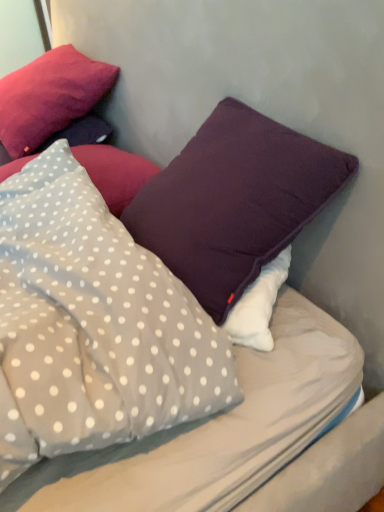
Question: From a real-world perspective, is gray polka dot pillow at center, the fourth pillow when ordered from top to bottom, physically located above or below purple matte pillow at upper right, which appears as the second pillow when ordered from the bottom?

Choices:
 (A) below
 (B) above

Answer: (A)

Question: From the image's perspective, is gray polka dot pillow at center, the fourth pillow when ordered from top to bottom, above or below purple matte pillow at upper right, arranged as the 3th pillow when viewed from the top?

Choices:
 (A) below
 (B) above

Answer: (A)

Question: Estimate the real-world distances between objects in this image. Which object is closer to the purple matte pillow at upper right, arranged as the 3th pillow when viewed from the top?

Choices:
 (A) white dotted fabric pillow at upper left, the second pillow when ordered from top to bottom
 (B) gray polka dot pillow at center, the fourth pillow when ordered from top to bottom
 (C) matte purple pillow at upper left, positioned as the 4th pillow in bottom-to-top order

Answer: (B)

Question: Estimate the real-world distances between objects in this image. Which object is farther from the gray polka dot pillow at center, which is counted as the first pillow, starting from the bottom?

Choices:
 (A) purple matte pillow at upper right, arranged as the 3th pillow when viewed from the top
 (B) white dotted fabric pillow at upper left, the third pillow in the bottom-to-top sequence
 (C) matte purple pillow at upper left, arranged as the first pillow when viewed from the top

Answer: (C)